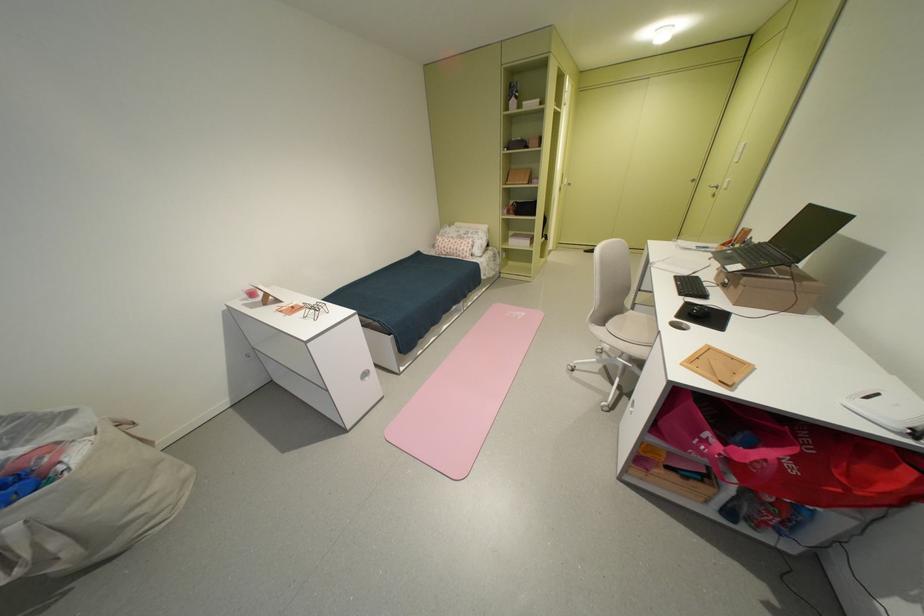
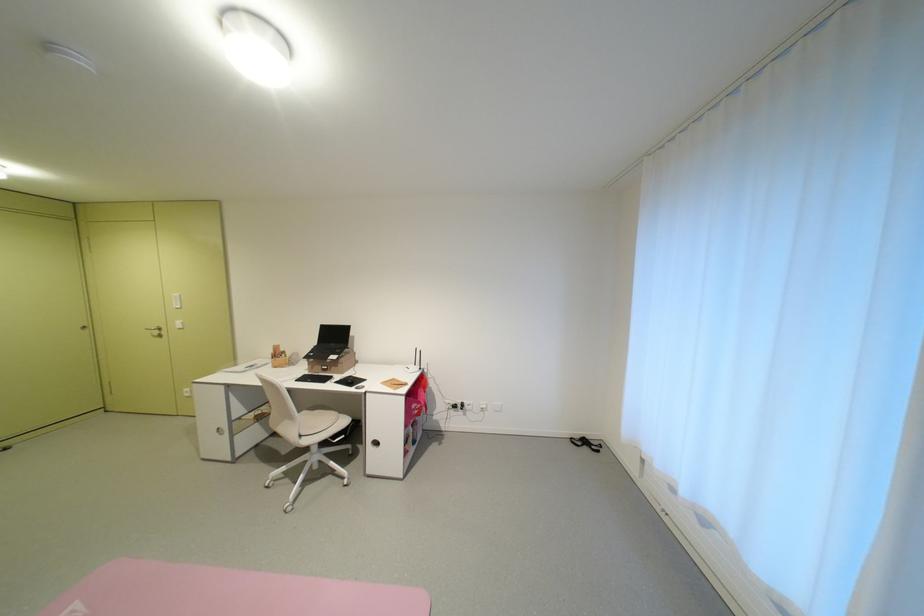
Find the pixel in the second image that matches (747,246) in the first image.

(293, 357)